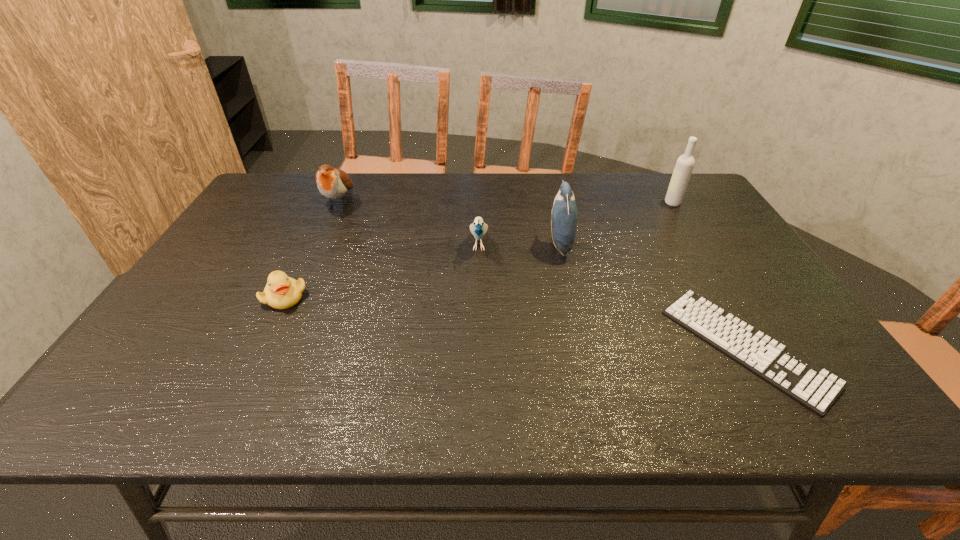
Find the location of `blank region between the rightmost bird and the leftmost bird`. blank region between the rightmost bird and the leftmost bird is located at coordinates (449, 224).

I want to click on empty space between the farthest bird and the tallest object, so click(x=506, y=203).

Identify the location of vacant region between the third object from right to left and the second shortest object. (422, 271).

Image resolution: width=960 pixels, height=540 pixels. I want to click on vacant space in between the rightmost bird and the leftmost bird, so click(449, 224).

I want to click on free space that is in between the tallest object and the farthest bird, so click(506, 203).

In order to click on free space between the computer keyboard and the fourth object from left to right in this screenshot , I will do pos(653,296).

I want to click on free area in between the rightmost bird and the leftmost bird, so click(449, 224).

Image resolution: width=960 pixels, height=540 pixels. I want to click on vacant space in between the vodka and the leftmost bird, so click(x=506, y=203).

Image resolution: width=960 pixels, height=540 pixels. I want to click on the fifth closest object to the fourth object from left to right, so [x=282, y=292].

Identify which object is the third nearest to the vodka. Please provide its 2D coordinates. Your answer should be formatted as a tuple, i.e. [(x, y)], where the tuple contains the x and y coordinates of a point satisfying the conditions above.

[(478, 228)]